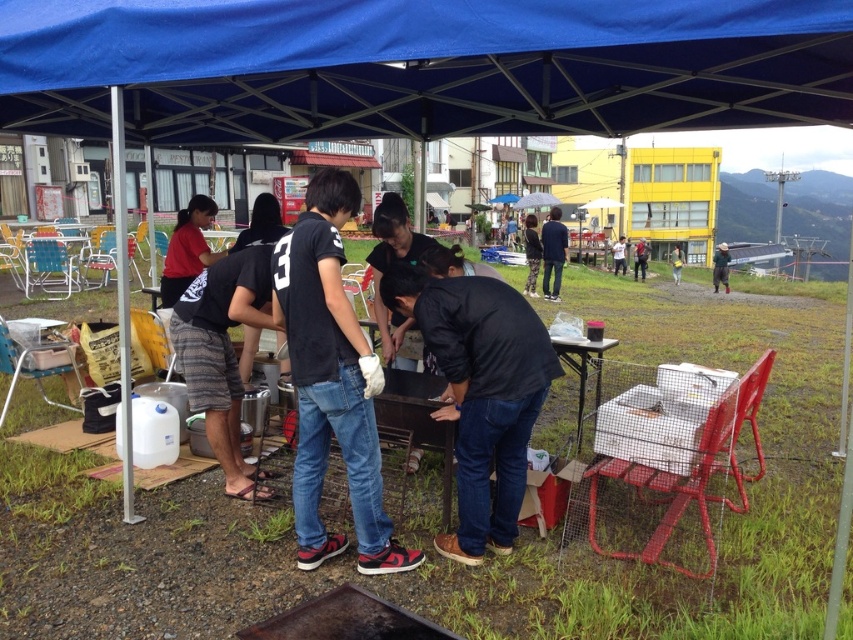
Question: Estimate the real-world distances between objects in this image. Which object is farther from the blue fabric canopy at upper center?

Choices:
 (A) black cotton shirt at center
 (B) metallic silver table at center
 (C) black matte jacket at center
 (D) dark blue shirt at center

Answer: (D)

Question: Is black cotton shirt at center thinner than metallic silver table at center?

Choices:
 (A) yes
 (B) no

Answer: (B)

Question: Does blue fabric canopy at upper center appear on the left side of plastic folding table at left?

Choices:
 (A) yes
 (B) no

Answer: (B)

Question: Which of these objects is positioned closest to the metallic silver table at center?

Choices:
 (A) plastic folding table at left
 (B) black matte jacket at center
 (C) dark blue shirt at center
 (D) blue fabric canopy at upper center

Answer: (B)

Question: Can you confirm if blue fabric canopy at upper center is wider than dark blue shirt at center?

Choices:
 (A) yes
 (B) no

Answer: (A)

Question: Estimate the real-world distances between objects in this image. Which object is closer to the dark blue shirt at center?

Choices:
 (A) plastic folding table at left
 (B) black matte jacket at center
 (C) metallic silver table at center
 (D) black cotton shirt at center

Answer: (C)